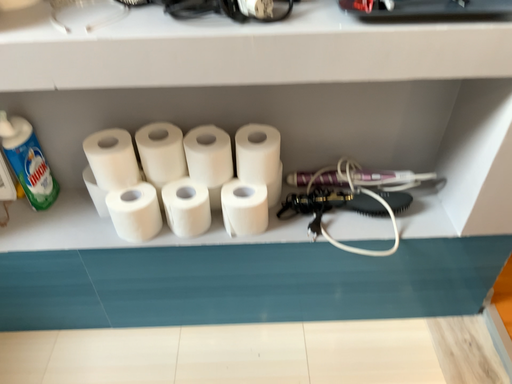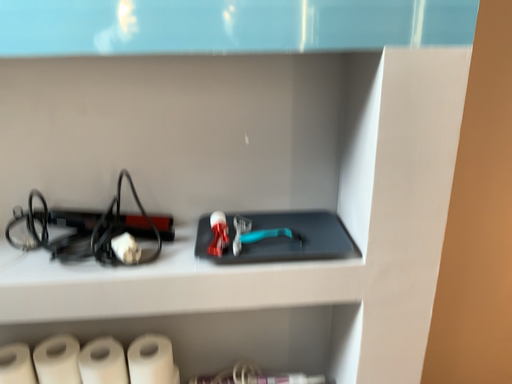
Question: Which way did the camera rotate in the video?

Choices:
 (A) rotated upward
 (B) rotated downward

Answer: (A)